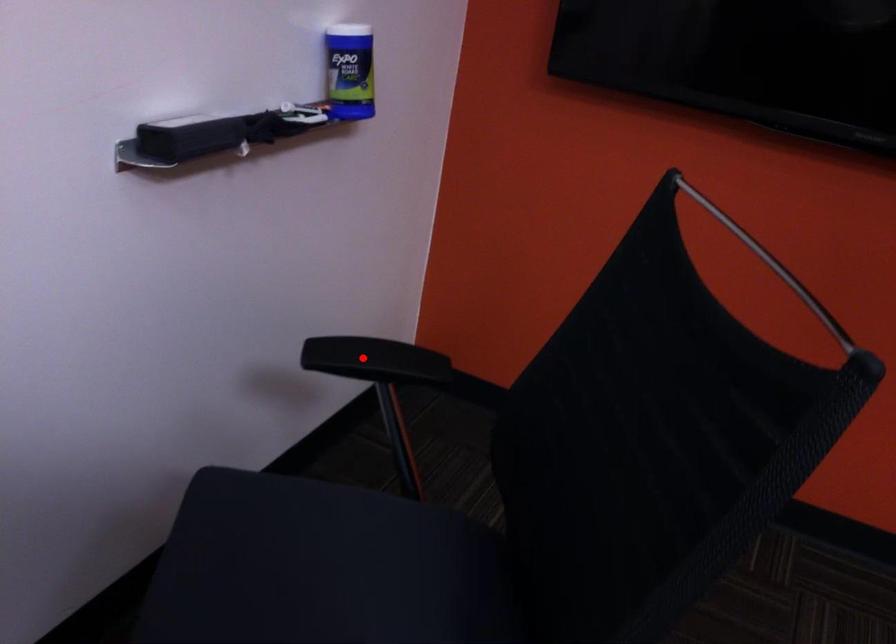
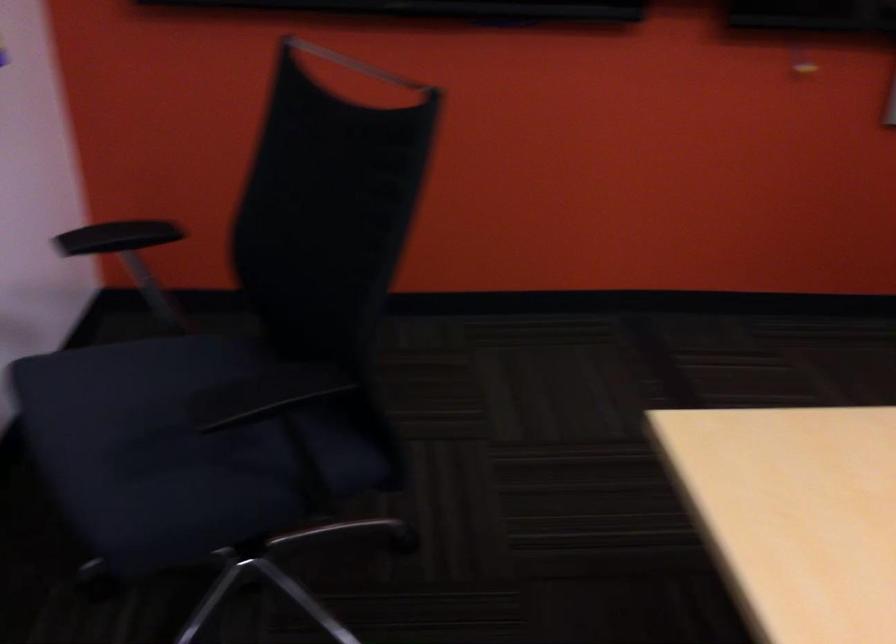
Question: I am providing you with two images of the same scene from different viewpoints. Given a red point in image1, look at the same physical point in image2. Is it:

Choices:
 (A) Closer to the viewpoint
 (B) Farther from the viewpoint

Answer: (B)